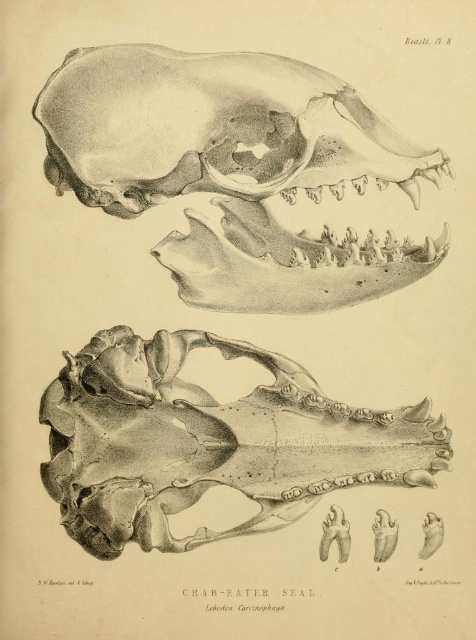
You are an art student analyzing the seal skull illustration. You notice two skulls labeled as gray pencil sketch skull at upper center and gray bone skull at center. Which one do you think is bigger?

The gray pencil sketch skull at upper center is larger in size than the gray bone skull at center, so the gray pencil sketch skull at upper center is bigger.

What are the coordinates of the gray pencil sketch skull at upper center in the image?

The gray pencil sketch skull at upper center is located at coordinates point (235,168).